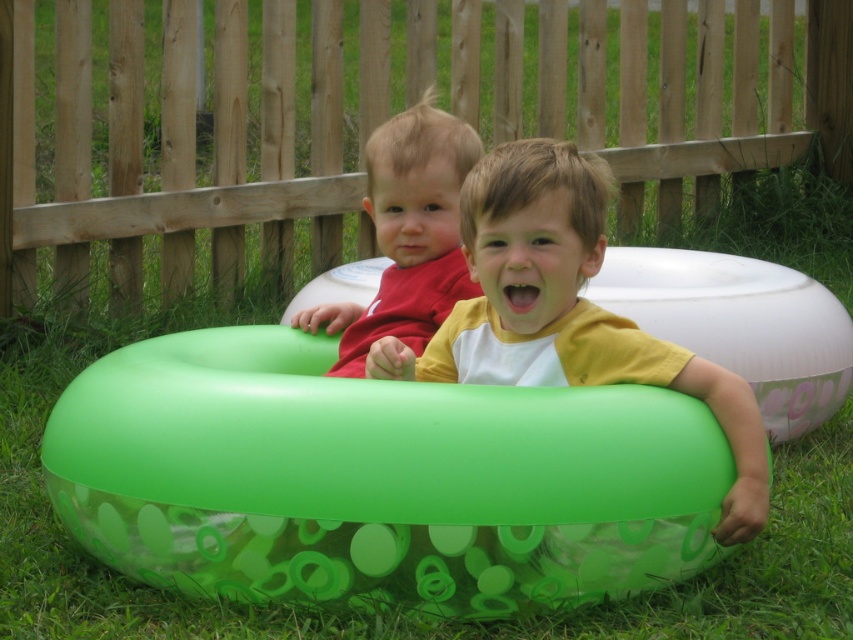
You are a photographer trying to capture a photo of the two children in their inflatable rings. You want to position yourself so that the green rubber ring at center is visible to the right of the matte red shirt at center. Is this possible based on the current arrangement?

Yes, because the green rubber ring at center is already positioned to the right of the matte red shirt at center in the current arrangement.